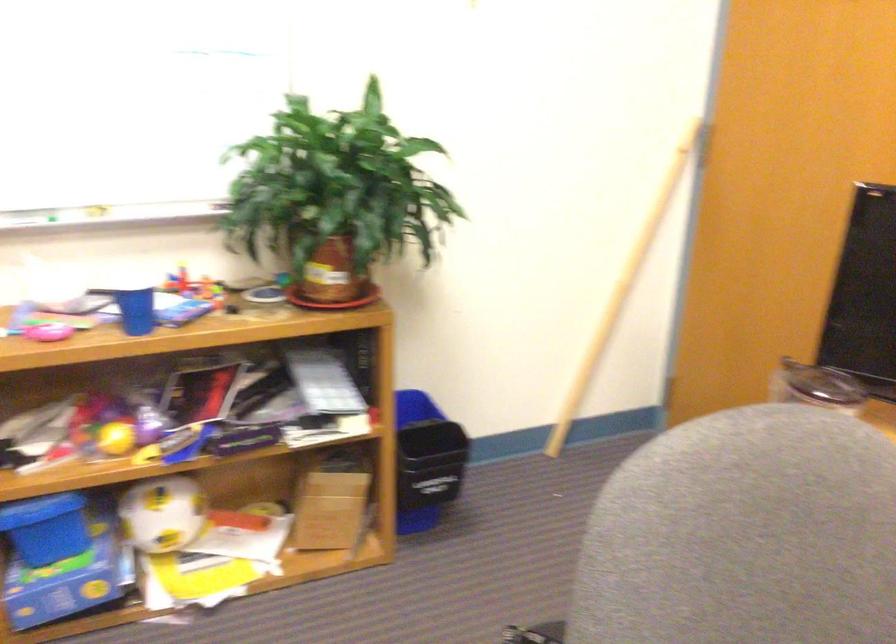
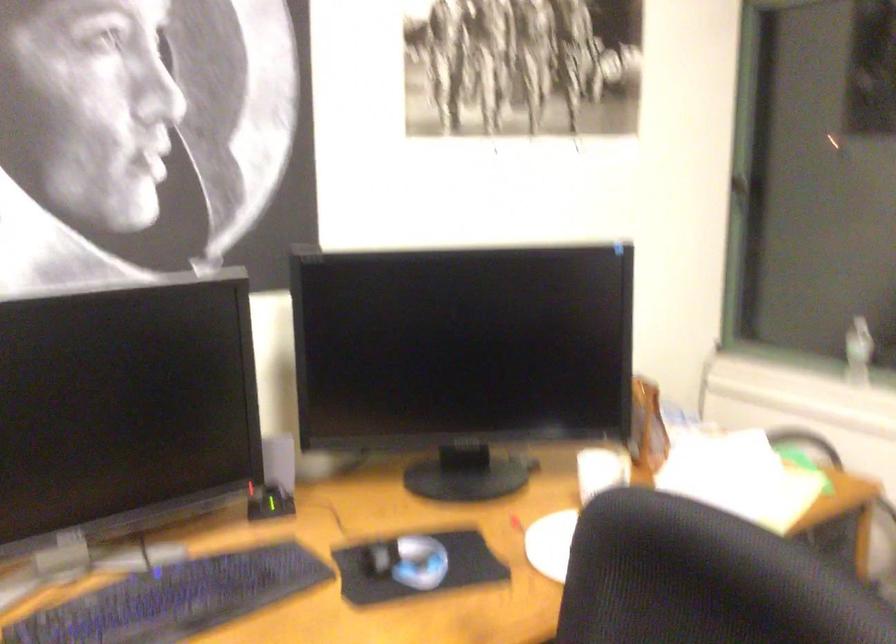
First-person continuous shooting, in which direction is the camera rotating?

The camera's rotation is toward right-down.